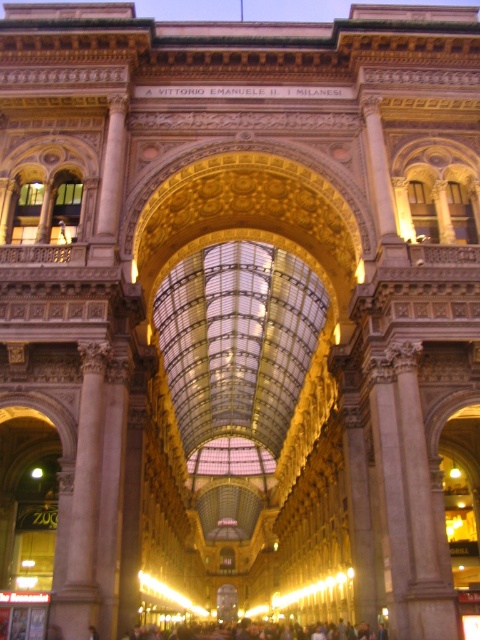
Question: Can you confirm if white marble column at left is smaller than dark gray concrete crowd at lower center?

Choices:
 (A) yes
 (B) no

Answer: (A)

Question: Which of the following is the farthest from the observer?

Choices:
 (A) (93, 349)
 (B) (299, 636)

Answer: (B)

Question: Does white marble column at left appear under dark gray concrete crowd at lower center?

Choices:
 (A) no
 (B) yes

Answer: (A)

Question: Which of the following is the closest to the observer?

Choices:
 (A) dark gray concrete crowd at lower center
 (B) white marble column at left

Answer: (B)

Question: Does white marble column at left have a smaller size compared to dark gray concrete crowd at lower center?

Choices:
 (A) yes
 (B) no

Answer: (A)